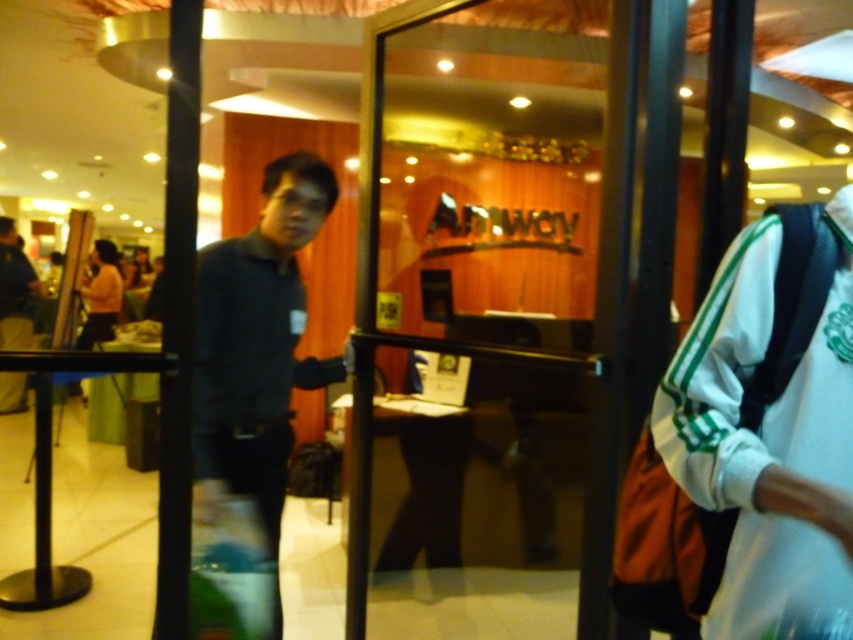
Is transparent glass door at center below dark blue shirt at center?

No.

Does transparent glass door at center have a greater width compared to dark blue shirt at center?

Yes.

Is point (364, 333) behind point (247, 353)?

Yes, point (364, 333) is farther from viewer.

Image resolution: width=853 pixels, height=640 pixels. I want to click on transparent glass door at center, so click(x=482, y=316).